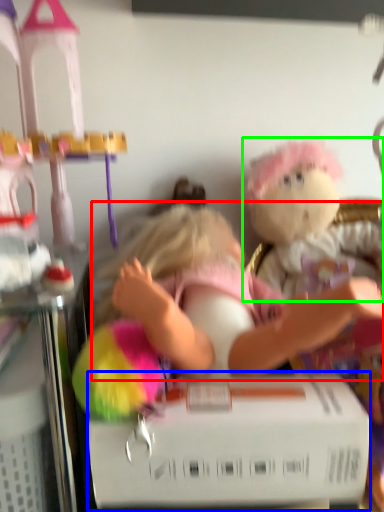
Question: Estimate the real-world distances between objects in this image. Which object is closer to person (highlighted by a red box), box (highlighted by a blue box) or toy (highlighted by a green box)?

Choices:
 (A) box
 (B) toy

Answer: (A)